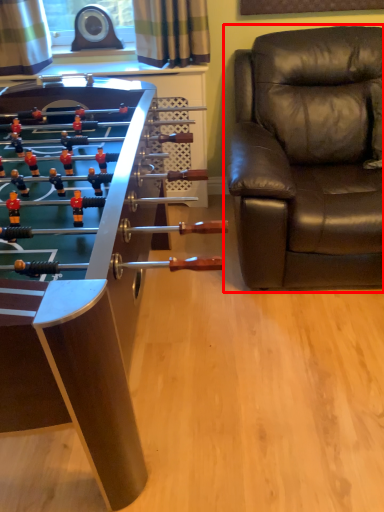
Question: From the image, what is the correct spatial relationship of chair (annotated by the red box) in relation to table?

Choices:
 (A) right
 (B) left

Answer: (A)